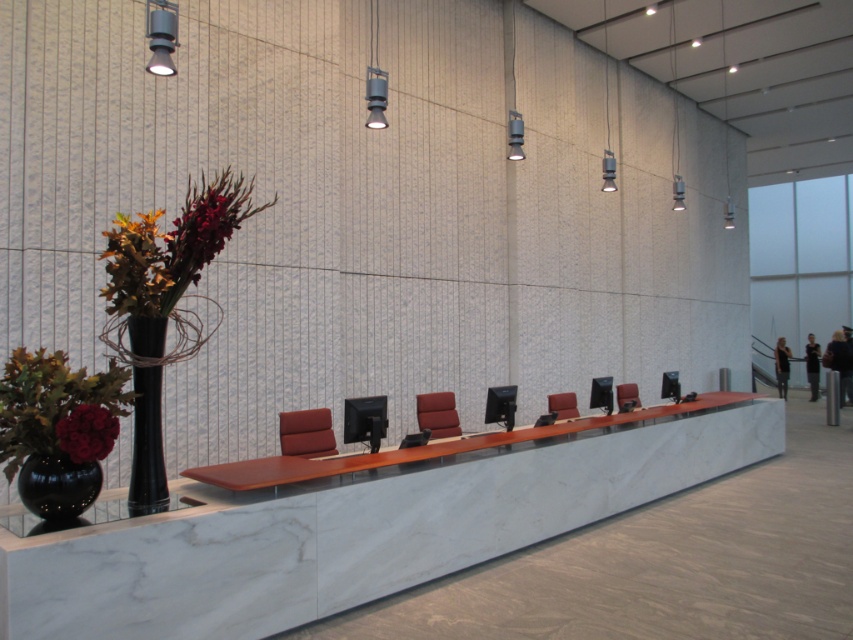
Question: Is black glossy vase at lower left further to camera compared to matte black vase at lower left?

Choices:
 (A) yes
 (B) no

Answer: (A)

Question: Which of the following is the closest to the observer?

Choices:
 (A) black glossy vase at left
 (B) matte black vase at lower left
 (C) white marble table at center
 (D) velvet maroon chair at center

Answer: (B)

Question: Which object is positioned farthest from the velvet maroon chair at center?

Choices:
 (A) black glossy vase at left
 (B) suede-like brown chair at center
 (C) matte brown leather chair at center
 (D) black glossy vase at lower left

Answer: (D)

Question: From the image, what is the correct spatial relationship of suede-like brown chair at center in relation to velvet maroon chair at center?

Choices:
 (A) above
 (B) below

Answer: (B)

Question: Is white marble table at center positioned in front of matte black vase at lower left?

Choices:
 (A) no
 (B) yes

Answer: (A)

Question: Among these objects, which one is nearest to the camera?

Choices:
 (A) matte red leather chair at center
 (B) suede-like brown chair at center
 (C) black glossy vase at left
 (D) white marble table at center

Answer: (D)